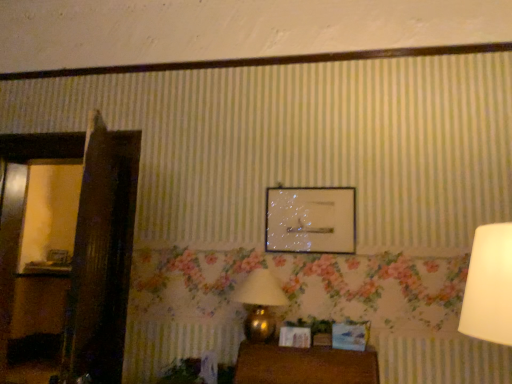
Question: Does wooden table at lower center have a smaller size compared to wooden picture frame at left, which is counted as the 1th picture frame, starting from the bottom?

Choices:
 (A) yes
 (B) no

Answer: (B)

Question: Is wooden table at lower center bigger than wooden picture frame at left, which is the second picture frame from right to left?

Choices:
 (A) no
 (B) yes

Answer: (B)

Question: Can you confirm if wooden table at lower center is wider than wooden picture frame at left, acting as the 1th picture frame starting from the left?

Choices:
 (A) no
 (B) yes

Answer: (B)

Question: Can you confirm if wooden table at lower center is taller than wooden picture frame at left, which is counted as the 1th picture frame, starting from the bottom?

Choices:
 (A) yes
 (B) no

Answer: (A)

Question: Is wooden table at lower center looking in the opposite direction of wooden picture frame at left, which appears as the 2th picture frame when viewed from the front?

Choices:
 (A) yes
 (B) no

Answer: (B)

Question: Looking at the image, does wooden table at lower center seem bigger or smaller compared to gold metallic table lamp at lower center?

Choices:
 (A) small
 (B) big

Answer: (B)

Question: Looking at their shapes, would you say wooden table at lower center is wider or thinner than gold metallic table lamp at lower center?

Choices:
 (A) wide
 (B) thin

Answer: (A)

Question: Is wooden table at lower center in front of or behind gold metallic table lamp at lower center in the image?

Choices:
 (A) behind
 (B) front

Answer: (B)

Question: Is wooden table at lower center spatially inside gold metallic table lamp at lower center, or outside of it?

Choices:
 (A) inside
 (B) outside

Answer: (B)

Question: Based on their sizes in the image, would you say gold metallic table lamp at lower center is bigger or smaller than wooden picture frame at left, marked as the first picture frame in a back-to-front arrangement?

Choices:
 (A) big
 (B) small

Answer: (A)

Question: From the image's perspective, is gold metallic table lamp at lower center located above or below wooden picture frame at left, acting as the 1th picture frame starting from the left?

Choices:
 (A) below
 (B) above

Answer: (B)

Question: Considering the positions of point (274, 329) and point (50, 256), is point (274, 329) closer or farther from the camera than point (50, 256)?

Choices:
 (A) closer
 (B) farther

Answer: (A)

Question: From a real-world perspective, relative to wooden picture frame at left, marked as the first picture frame in a back-to-front arrangement, is gold metallic table lamp at lower center vertically above or below?

Choices:
 (A) below
 (B) above

Answer: (A)

Question: In the image, is wooden picture frame at left, which appears as the 2th picture frame when viewed from the front, positioned in front of or behind wooden table at lower center?

Choices:
 (A) behind
 (B) front

Answer: (A)

Question: Which is correct: wooden picture frame at left, which appears as the 2th picture frame when viewed from the front, is inside wooden table at lower center, or outside of it?

Choices:
 (A) inside
 (B) outside

Answer: (B)